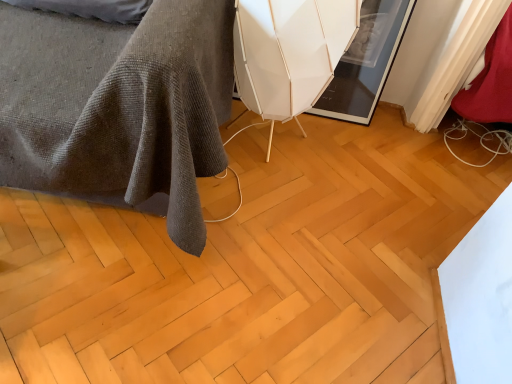
Identify the location of free spot above natural wood floor at center (from a real-world perspective). Image resolution: width=512 pixels, height=384 pixels. coord(234,262).